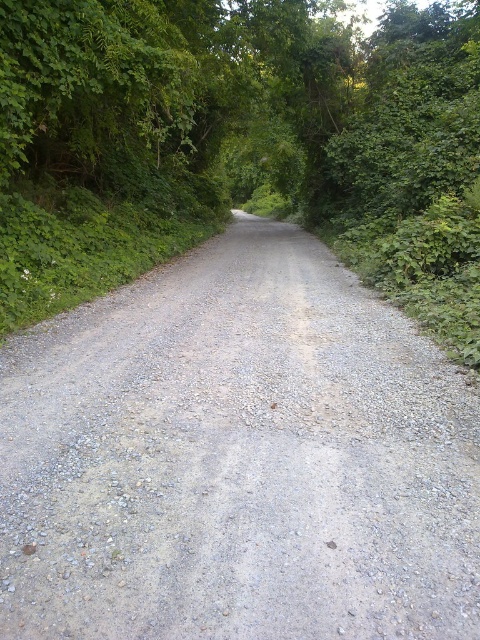
Does gray gravel road at center appear on the right side of green leafy forest at center?

In fact, gray gravel road at center is to the left of green leafy forest at center.

Image resolution: width=480 pixels, height=640 pixels. Describe the element at coordinates (238, 460) in the screenshot. I see `gray gravel road at center` at that location.

This screenshot has height=640, width=480. I want to click on gray gravel road at center, so click(238, 460).